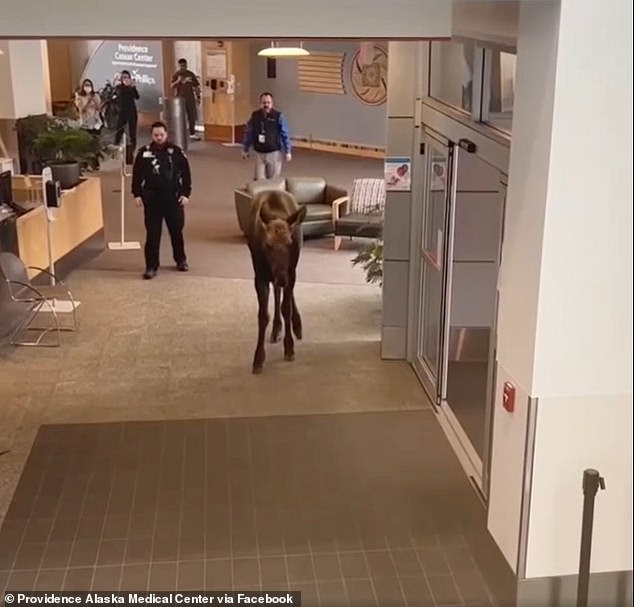
Where is `glass door enterence`? glass door enterence is located at coordinates (467, 248).